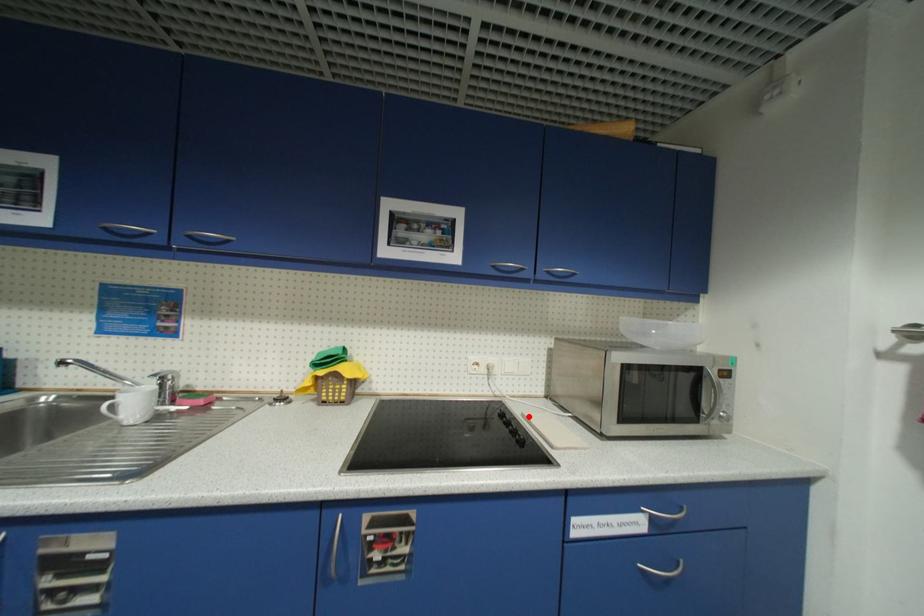
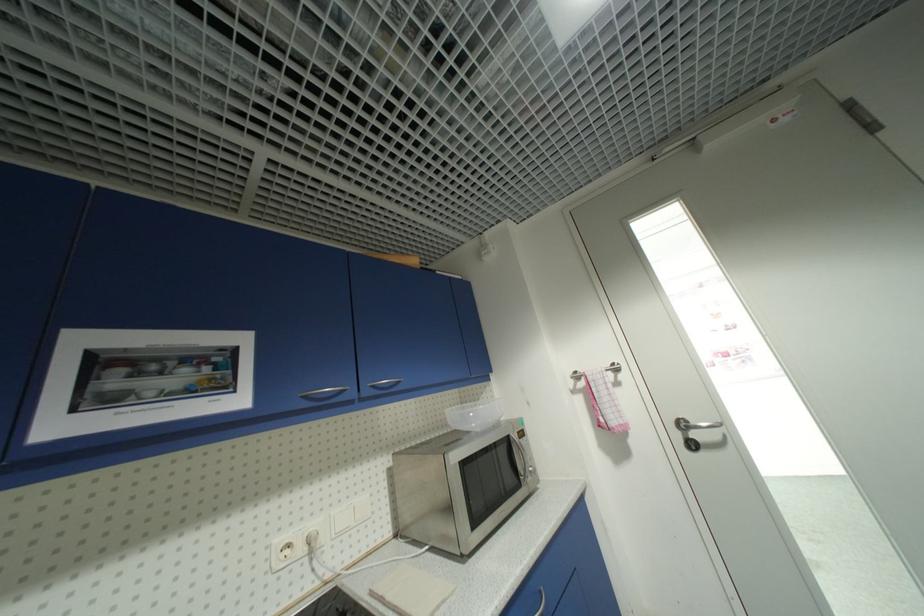
The point at the highlighted location is marked in the first image. Where is the corresponding point in the second image?

(378, 594)